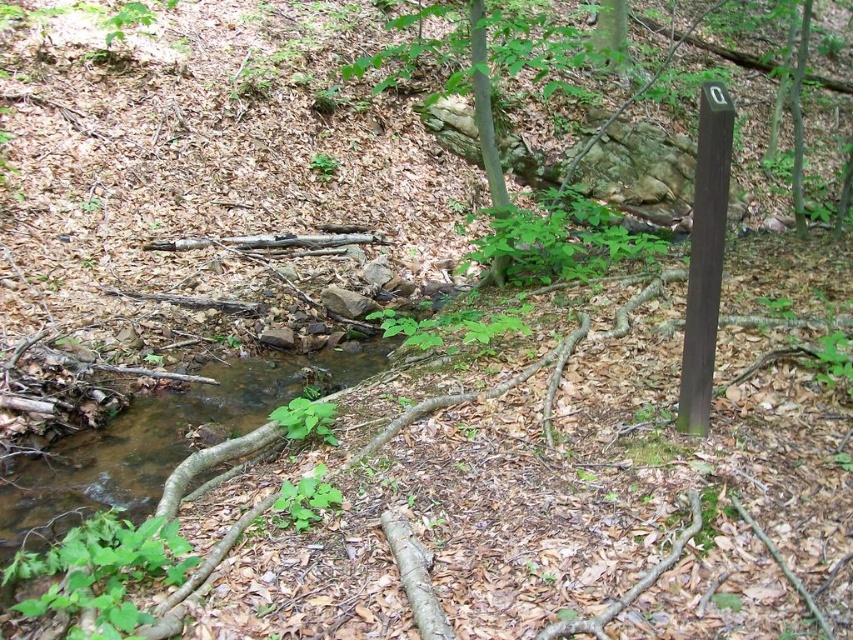
Is point (335, 372) positioned in front of point (722, 182)?

No, (335, 372) is further to viewer.

The image size is (853, 640). What do you see at coordinates (160, 442) in the screenshot?
I see `clear water stream at center` at bounding box center [160, 442].

Between point (200, 372) and point (705, 109), which one is positioned in front?

Point (705, 109)

Where is `clear water stream at center`? clear water stream at center is located at coordinates (160, 442).